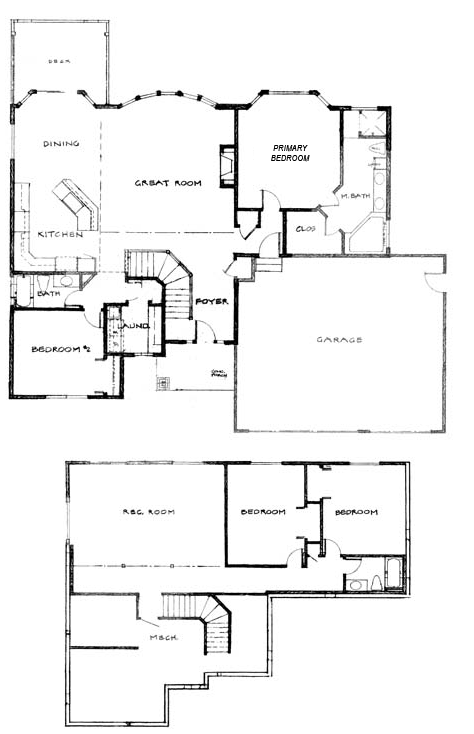
Locate an element on the screen. This screenshot has width=474, height=734. bath tub is located at coordinates (395, 570), (375, 236), (21, 286).